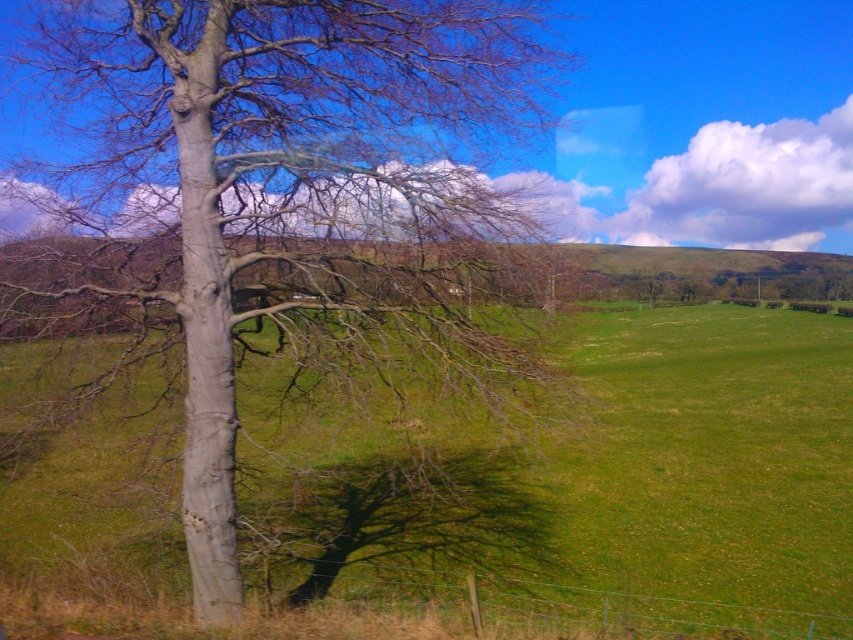
Question: Which of the following is the closest to the observer?

Choices:
 (A) smooth gray tree at left
 (B) green grassy field at left

Answer: (B)

Question: Is smooth gray tree at left smaller than green grassy field at left?

Choices:
 (A) no
 (B) yes

Answer: (B)

Question: Is smooth gray tree at left bigger than green grassy field at left?

Choices:
 (A) no
 (B) yes

Answer: (A)

Question: Can you confirm if smooth gray tree at left is positioned to the left of green grassy field at left?

Choices:
 (A) yes
 (B) no

Answer: (A)